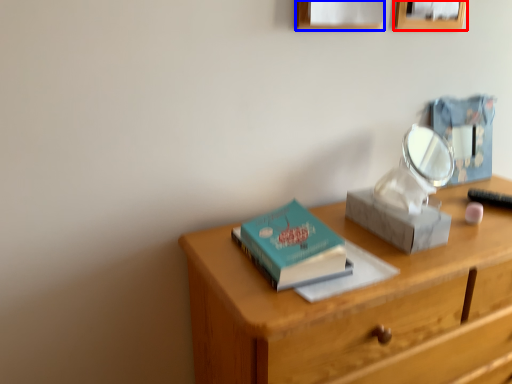
Question: Which object is closer to the camera taking this photo, picture frame (highlighted by a red box) or picture frame (highlighted by a blue box)?

Choices:
 (A) picture frame
 (B) picture frame

Answer: (B)